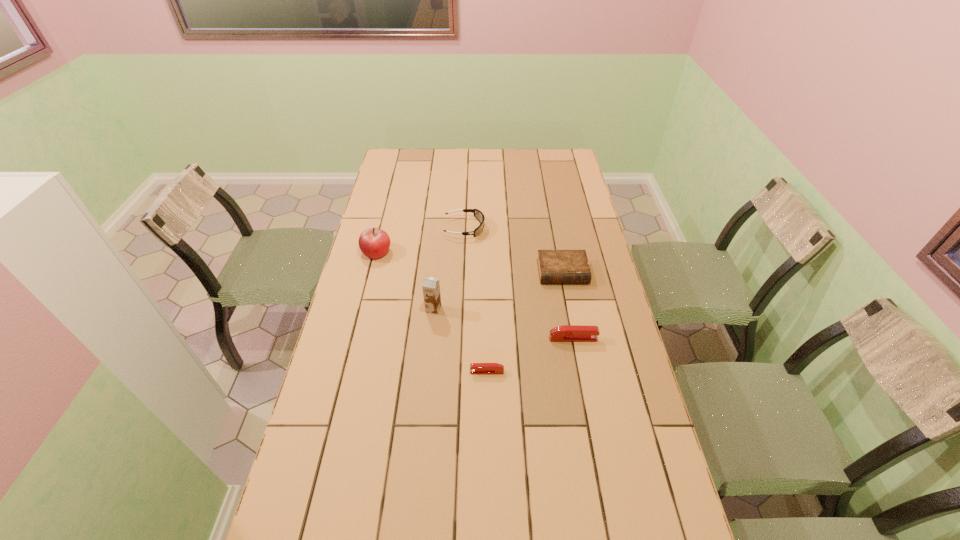
The height and width of the screenshot is (540, 960). I want to click on diary located at the right edge, so pyautogui.click(x=554, y=266).

The height and width of the screenshot is (540, 960). In the image, there is a desktop. Find the location of `vacant area at the far edge`. vacant area at the far edge is located at coordinates (527, 171).

The image size is (960, 540). Identify the location of vacant space at the near edge of the desktop. (581, 515).

What are the coordinates of `vacant space at the left edge of the desktop` in the screenshot? It's located at (364, 353).

I want to click on vacant space at the right edge of the desktop, so click(x=552, y=211).

This screenshot has height=540, width=960. Find the location of `free spot at the near left corner of the desktop`. free spot at the near left corner of the desktop is located at coordinates (325, 513).

Find the location of a particular element. The image size is (960, 540). free space at the far right corner of the desktop is located at coordinates (556, 172).

Locate an element on the screen. empty space between the farthest object and the leftmost object is located at coordinates click(420, 240).

Find the location of a particular element. The image size is (960, 540). empty space that is in between the farthest object and the farther stapler is located at coordinates (518, 284).

What are the coordinates of `free space between the diary and the farthest object` in the screenshot? It's located at (514, 250).